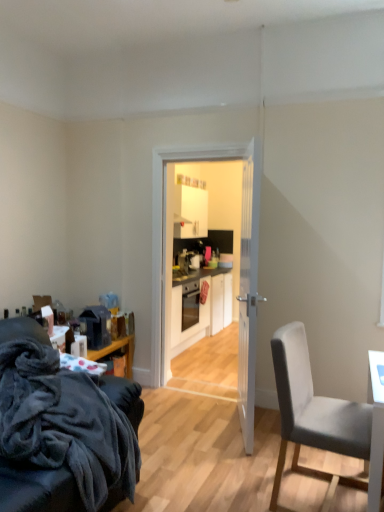
Question: Can you confirm if velvety dark gray couch at lower left, which appears as the 2th chair when viewed from the right, is shorter than white glossy door at center?

Choices:
 (A) no
 (B) yes

Answer: (B)

Question: Does velvety dark gray couch at lower left, which appears as the 2th chair when viewed from the right, have a larger size compared to white glossy door at center?

Choices:
 (A) yes
 (B) no

Answer: (A)

Question: Does velvety dark gray couch at lower left, which appears as the 2th chair when viewed from the right, have a lesser width compared to white glossy door at center?

Choices:
 (A) yes
 (B) no

Answer: (B)

Question: From the image's perspective, is velvety dark gray couch at lower left, arranged as the first chair when viewed from the left, under white glossy door at center?

Choices:
 (A) yes
 (B) no

Answer: (A)

Question: Can you confirm if velvety dark gray couch at lower left, which appears as the 2th chair when viewed from the right, is positioned to the left of white glossy door at center?

Choices:
 (A) yes
 (B) no

Answer: (A)

Question: Is velvety dark gray couch at lower left, arranged as the first chair when viewed from the left, next to white glossy door at center and touching it?

Choices:
 (A) yes
 (B) no

Answer: (B)

Question: Considering the relative sizes of gray fabric chair at right, which is counted as the second chair, starting from the left, and white glossy door at center in the image provided, is gray fabric chair at right, which is counted as the second chair, starting from the left, wider than white glossy door at center?

Choices:
 (A) yes
 (B) no

Answer: (A)

Question: Considering the relative positions of gray fabric chair at right, which is counted as the second chair, starting from the left, and white glossy door at center in the image provided, is gray fabric chair at right, which is counted as the second chair, starting from the left, behind white glossy door at center?

Choices:
 (A) no
 (B) yes

Answer: (A)

Question: Does gray fabric chair at right, placed as the first chair when sorted from right to left, have a larger size compared to white glossy door at center?

Choices:
 (A) no
 (B) yes

Answer: (B)

Question: From a real-world perspective, is gray fabric chair at right, placed as the first chair when sorted from right to left, below white glossy door at center?

Choices:
 (A) yes
 (B) no

Answer: (A)

Question: From the image's perspective, would you say gray fabric chair at right, which is counted as the second chair, starting from the left, is shown under white glossy door at center?

Choices:
 (A) no
 (B) yes

Answer: (B)

Question: Considering the relative sizes of gray fabric chair at right, placed as the first chair when sorted from right to left, and white glossy door at center in the image provided, is gray fabric chair at right, placed as the first chair when sorted from right to left, shorter than white glossy door at center?

Choices:
 (A) yes
 (B) no

Answer: (A)

Question: Is white matte cabinet at center at the left side of matte black oven at center?

Choices:
 (A) yes
 (B) no

Answer: (B)